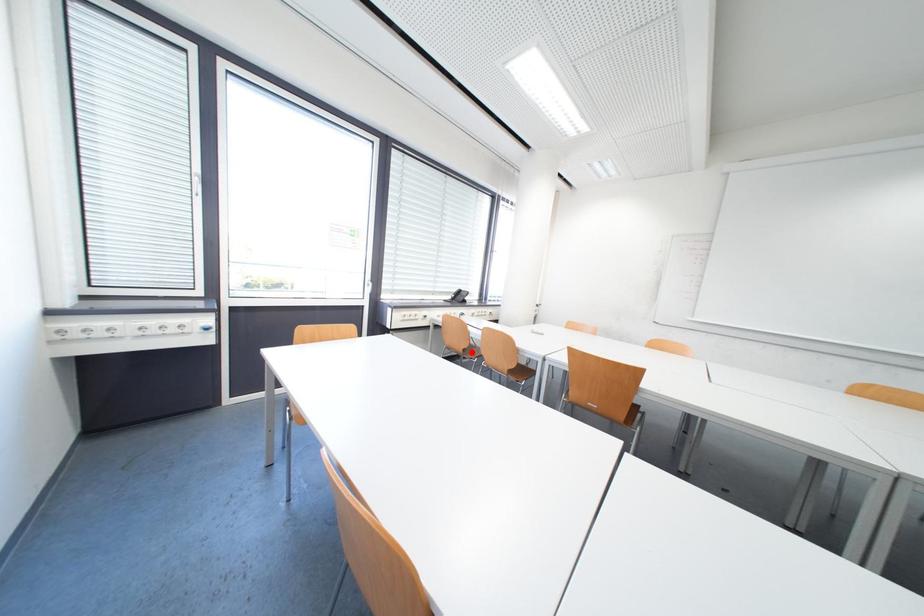
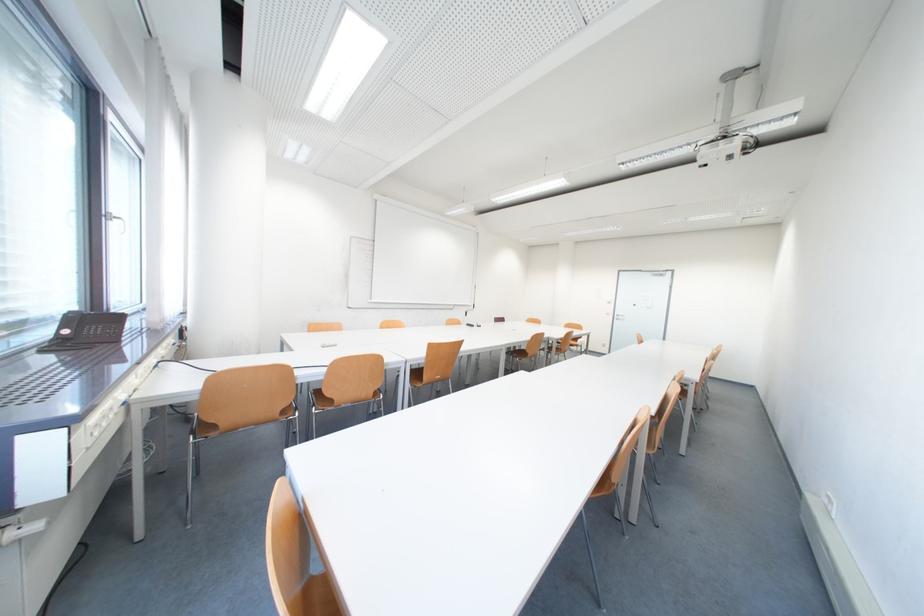
Question: A red point is marked in image1. In image2, is the corresponding 3D point closer to the camera or farther? Reply with the corresponding letter.

Choices:
 (A) The corresponding 3D point is closer.
 (B) The corresponding 3D point is farther.

Answer: (A)